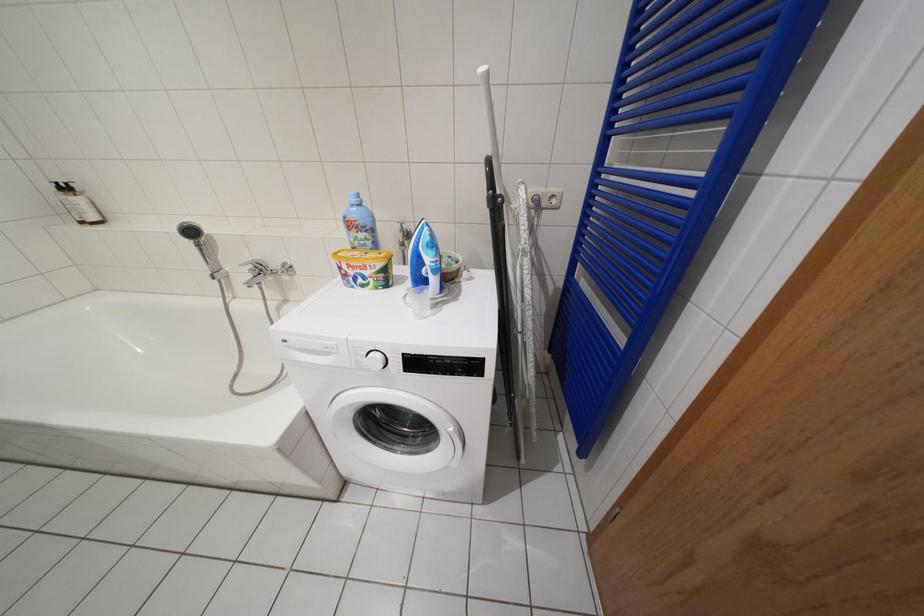
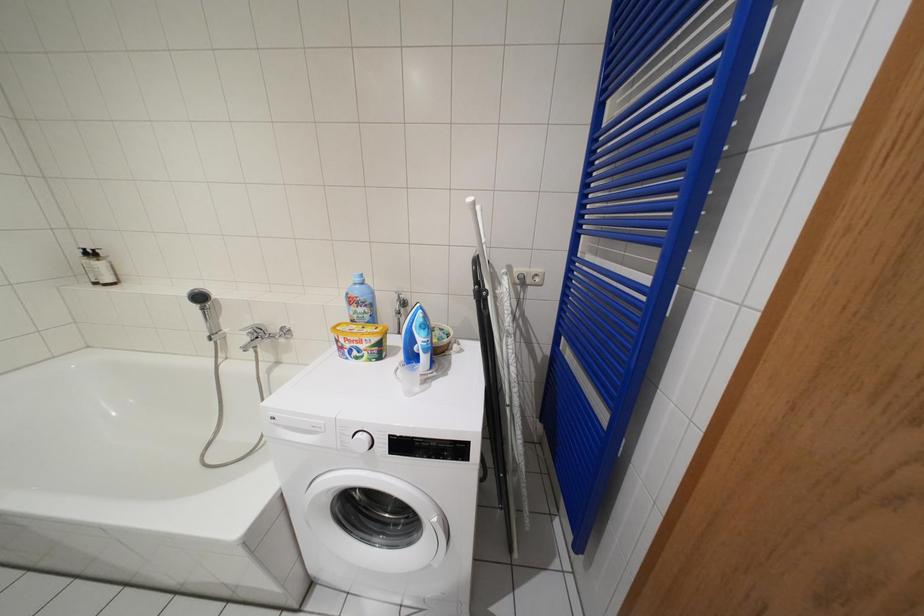
Question: The images are taken continuously from a first-person perspective. In which direction are you moving?

Choices:
 (A) Left
 (B) Right
 (C) Forward
 (D) Backward

Answer: (D)